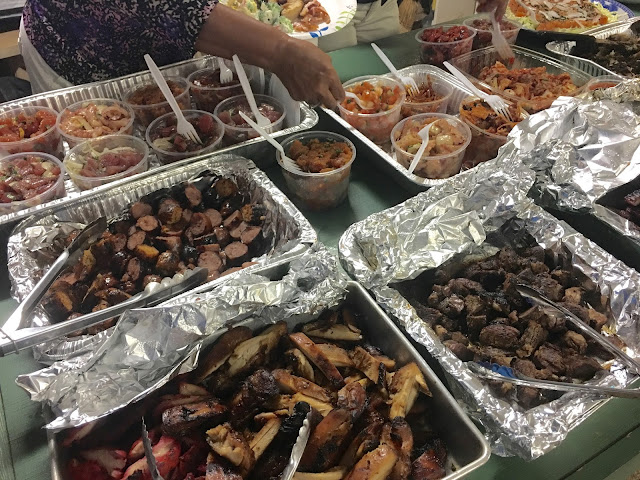
I want to click on paper plate, so click(344, 1).